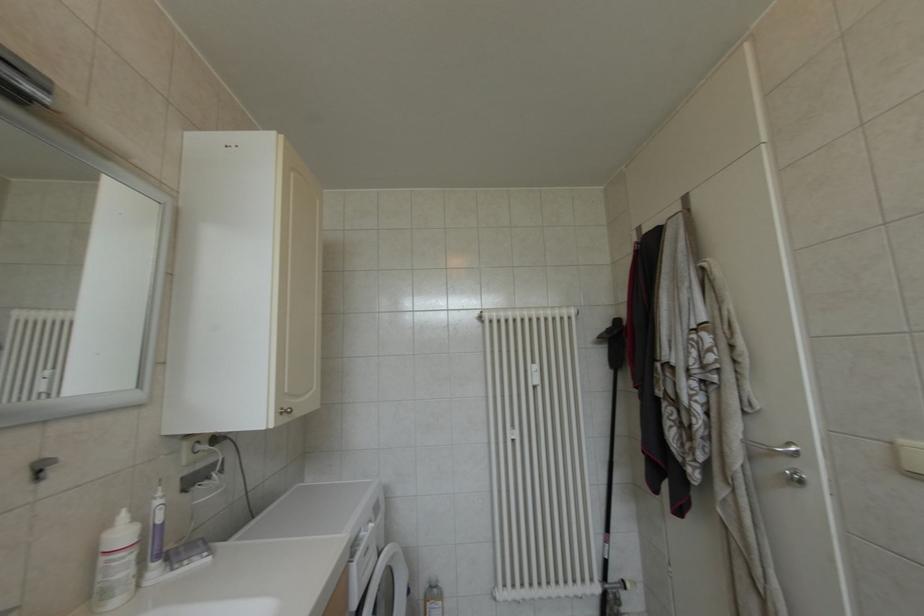
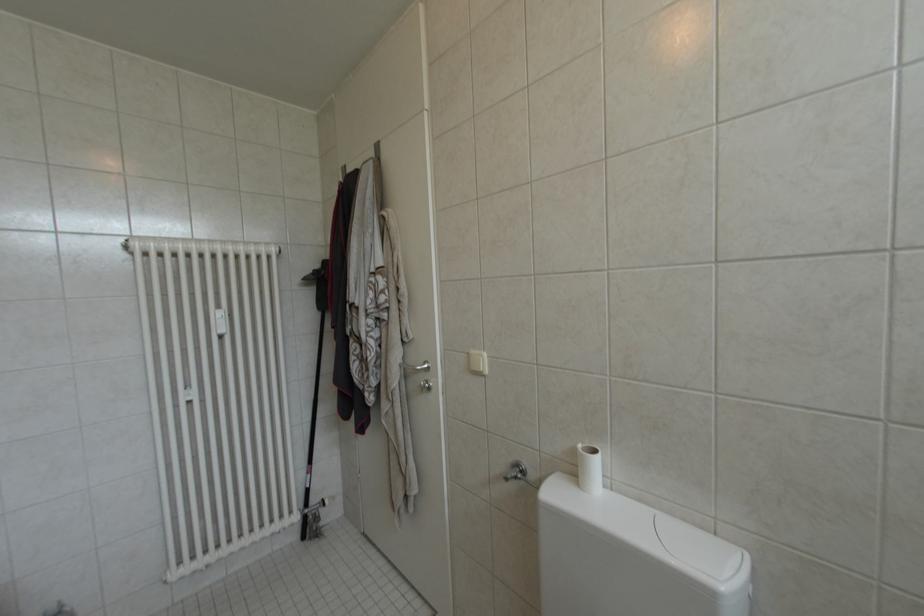
Question: The camera is either moving clockwise (left) or counter-clockwise (right) around the object. The first image is from the beginning of the video and the second image is from the end. Is the camera moving left or right when shooting the video?

Choices:
 (A) Left
 (B) Right

Answer: (A)